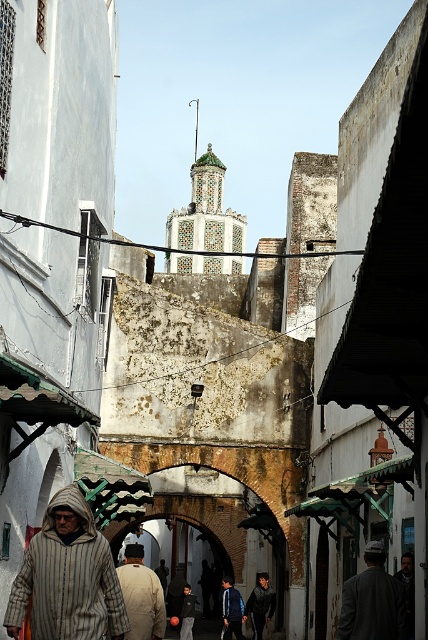
You are a delivery person carrying a box that is 1.5 meters tall. You are standing in the alleyway and see the dark gray woolen jacket at center and the blue denim jacket at center. Can you determine which jacket you can place the box on top of without it exceeding the height of the alleyway?

The dark gray woolen jacket at center has a lesser height compared to blue denim jacket at center. Since the box is 1.5 meters tall, you should place it on the blue denim jacket at center as it is taller and would provide a higher base without exceeding the alleyway height.

You are a photographer standing in the narrow alleyway and want to take a photo of the dark gray woolen jacket at center. The camera you are using has a maximum focusing distance of 40 meters. Will the jacket be in focus?

The dark gray woolen jacket at center is 39.47 meters from camera, so yes, the jacket will be in focus since it is within the camera maximum focusing distance of 40 meters.

You are a traveler standing at the entrance of the alleyway and see two jackets hanging on a rack in the center. The jackets are labeled as dark blue jacket at center and blue denim jacket at center. Which jacket is positioned to the right when viewed from your perspective?

The dark blue jacket at center is positioned to the right of the blue denim jacket at center when viewed from your perspective.